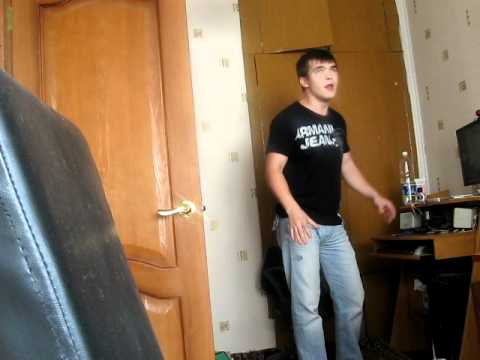
Where is `door handle`? This screenshot has width=480, height=360. door handle is located at coordinates (150, 207).